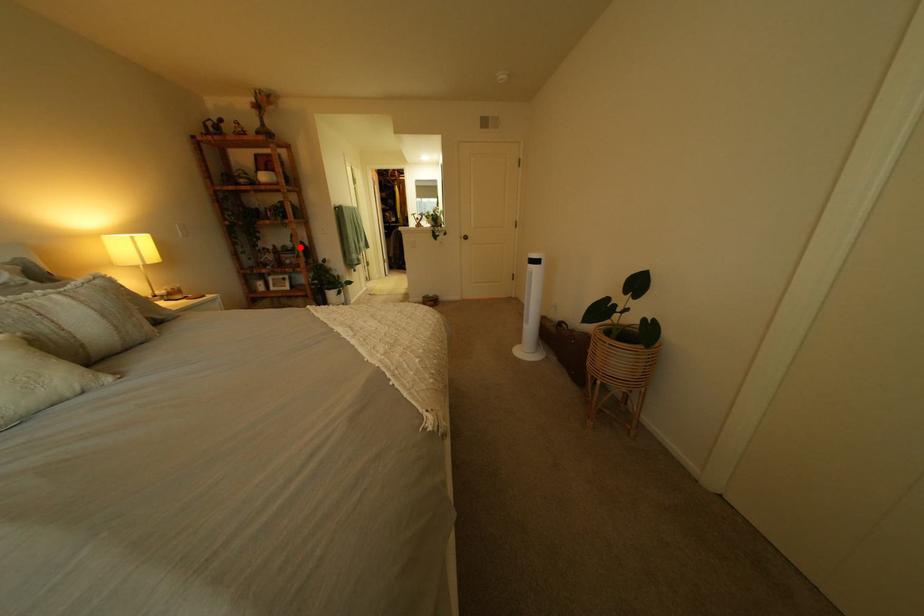
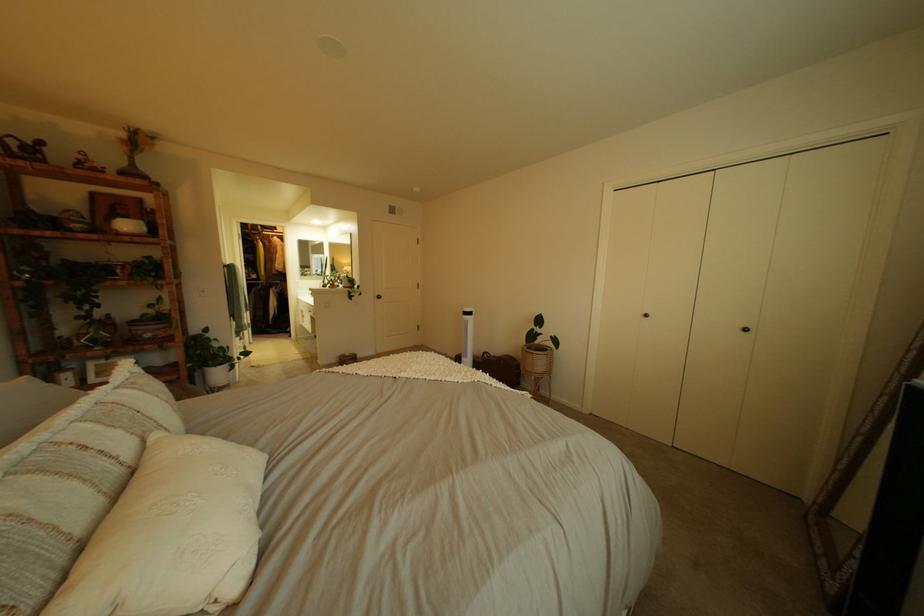
Locate, in the second image, the point that corresponds to the highlighted location in the first image.

(161, 315)